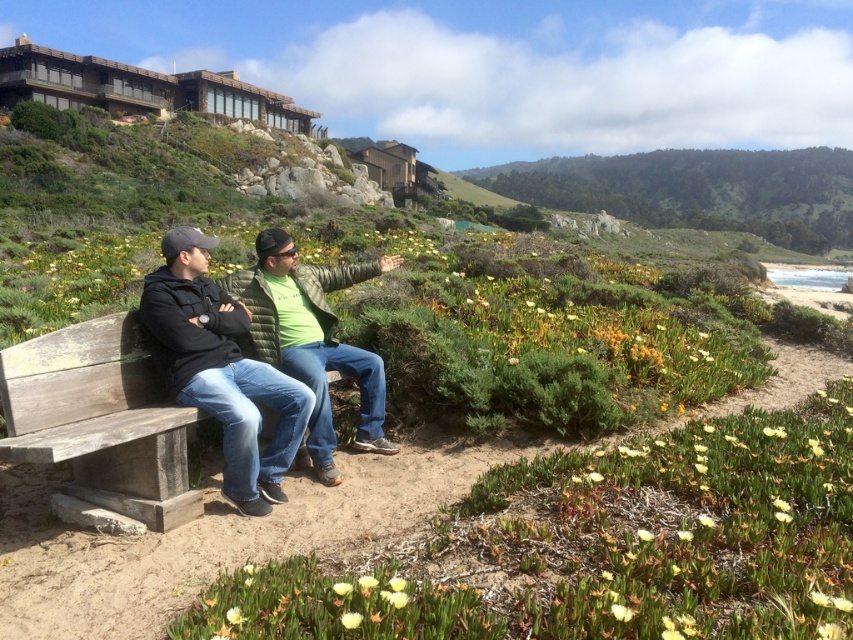
Who is more distant from viewer, (102, 349) or (254, 509)?

The point (102, 349) is behind.

Is point (24, 353) farther from viewer compared to point (258, 512)?

No, it is in front of (258, 512).

This screenshot has height=640, width=853. What are the coordinates of `weathered wood bench at lower left` in the screenshot? It's located at (100, 419).